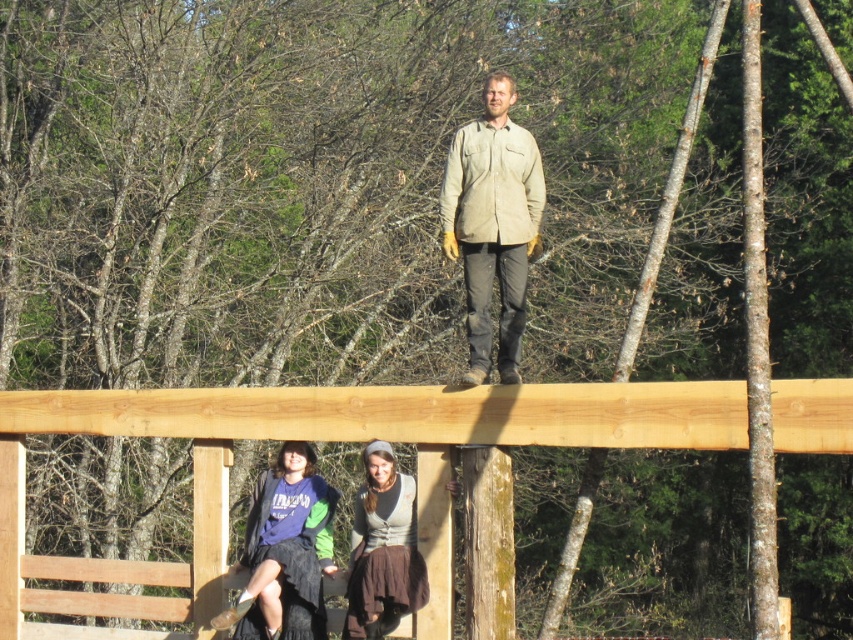
You are a photographer trying to capture a closeup shot of the khaki cotton shirt at center and the brown fabric skirt at lower center. Since you want both subjects to appear equally sized in the photo, which object should you move closer to the camera?

To make both the khaki cotton shirt at center and the brown fabric skirt at lower center appear equally sized in the photo, you should move the brown fabric skirt at lower center closer to the camera because its width is smaller than the khaki cotton shirt at center.

You are a construction worker checking the dimensions of the natural wood beam at upper center and the brown fabric skirt at lower center. Which object is shorter?

The natural wood beam at upper center is shorter than the brown fabric skirt at lower center according to the description.

You are a safety inspector at the construction site. You need to ensure that the khaki cotton shirt at center is at least 3 meters away from the natural wood beam at upper center to comply with safety regulations. Based on the scene description, is the current distance compliant?

The distance between the natural wood beam at upper center and the khaki cotton shirt at center is 2.97 meters, which is less than the required 3 meters. Therefore, the current distance does not comply with safety regulations.